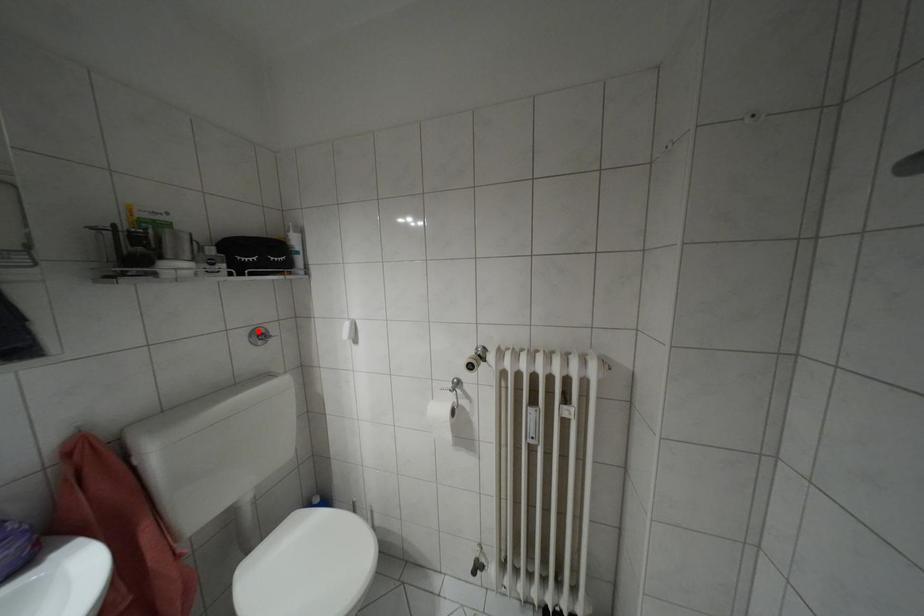
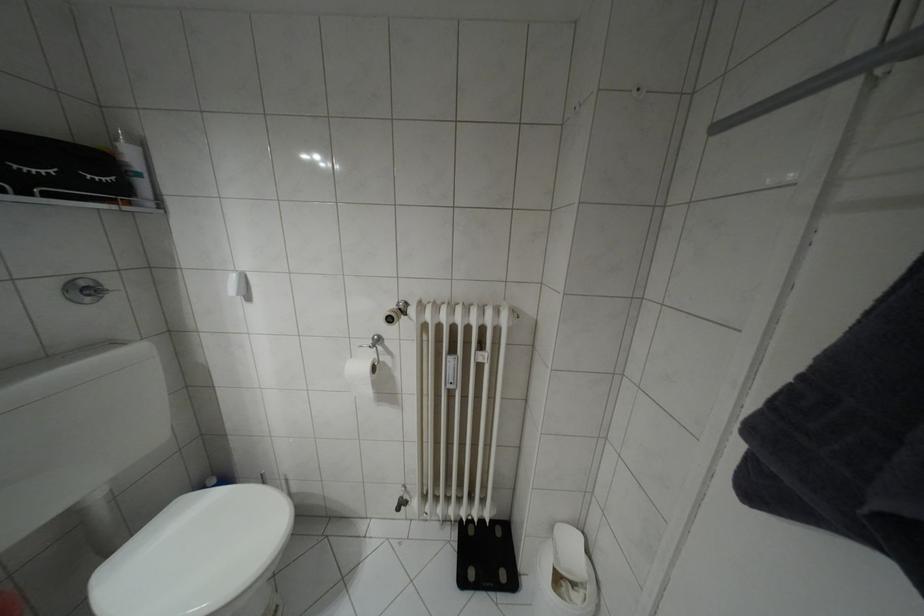
Locate, in the second image, the point that corresponds to the highlighted location in the first image.

(81, 284)